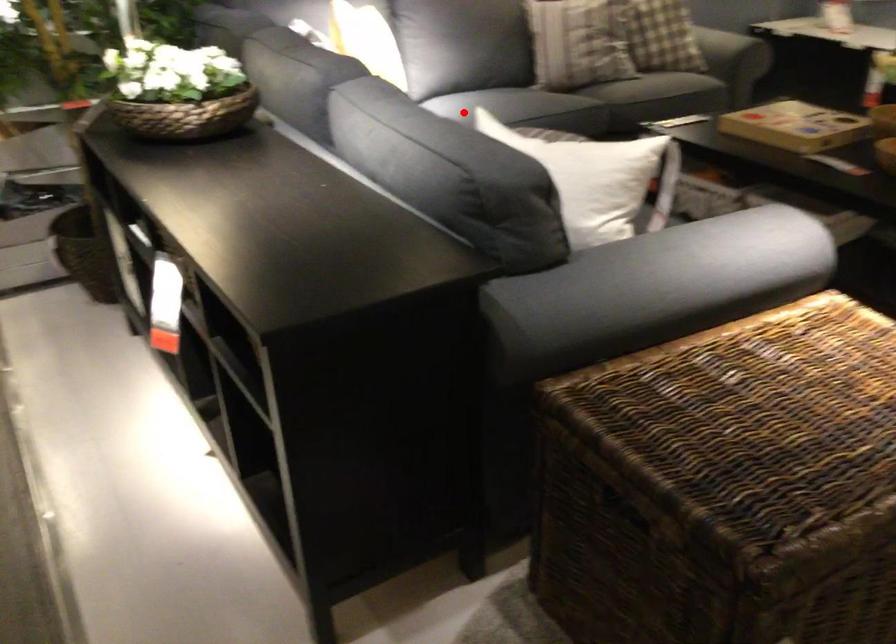
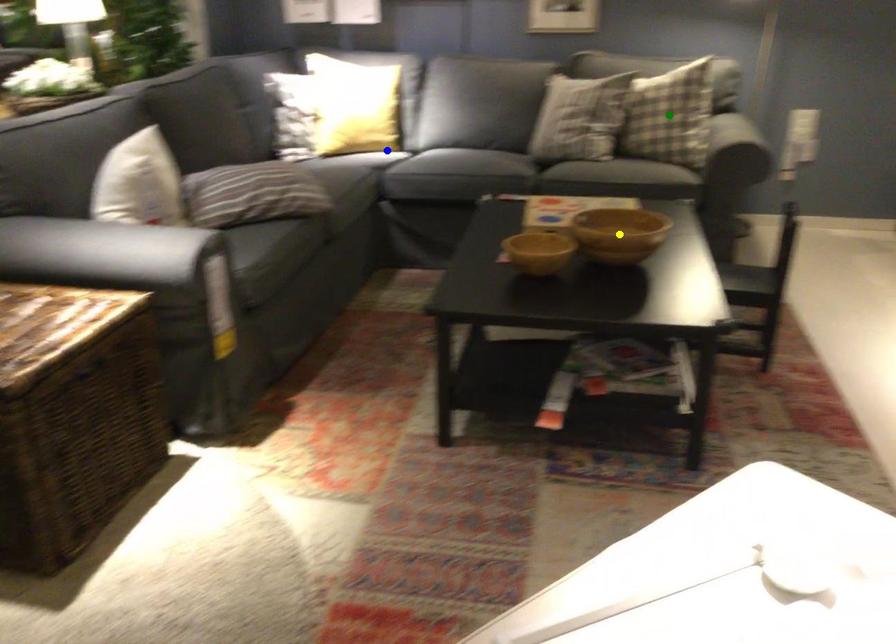
Question: I am providing you with two images of the same scene from different viewpoints. A red point is marked on the first image. You are given multiple points on the second image. Which mark in image 2 goes with the point in image 1?

Choices:
 (A) green point
 (B) blue point
 (C) yellow point

Answer: (B)